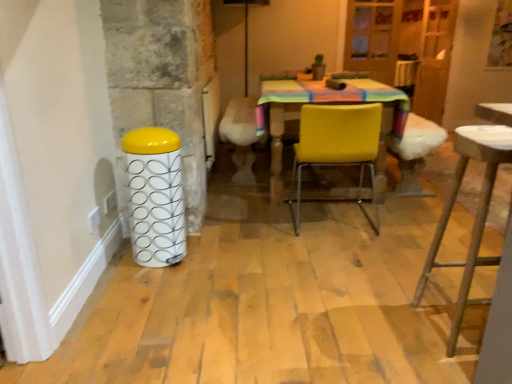
I want to click on yellow matte chair at center, so click(338, 147).

Is yellow matte chair at center far from white glossy bar stool at left?

yellow matte chair at center is actually quite close to white glossy bar stool at left.

Which point is more forward, (322, 163) or (138, 187)?

Positioned in front is point (138, 187).

Is white glossy bar stool at left completely or partially inside yellow matte chair at center?

No.

From a real-world perspective, is yellow matte chair at center physically below white glossy bar stool at left?

No.

Which object is closer to the camera, white glossy bar stool at left or yellow matte chair at center?

white glossy bar stool at left is more forward.

Is white glossy bar stool at left turned away from yellow matte chair at center?

No, white glossy bar stool at left's orientation is not away from yellow matte chair at center.

Can you confirm if white glossy bar stool at left is positioned to the left of yellow matte chair at center?

Indeed, white glossy bar stool at left is positioned on the left side of yellow matte chair at center.

Is metallic stool at right with white glossy bar stool at left?

No, metallic stool at right is not with white glossy bar stool at left.

Between point (475, 145) and point (157, 197), which one is positioned behind?

The point (157, 197) is farther from the camera.

Consider the image. Is the depth of metallic stool at right greater than that of white glossy bar stool at left?

No, it is not.

Considering the sizes of objects metallic stool at right and white glossy bar stool at left in the image provided, who is bigger, metallic stool at right or white glossy bar stool at left?

With larger size is metallic stool at right.

Is yellow matte chair at center surrounded by metallic stool at right?

No, yellow matte chair at center is not inside metallic stool at right.

From a real-world perspective, does metallic stool at right sit lower than yellow matte chair at center?

No, from a real-world perspective, metallic stool at right is not under yellow matte chair at center.

Would you consider metallic stool at right to be distant from yellow matte chair at center?

metallic stool at right is near yellow matte chair at center, not far away.

Visually, is metallic stool at right positioned to the left or to the right of yellow matte chair at center?

metallic stool at right is to the right of yellow matte chair at center.

Is yellow matte chair at center thinner than metallic stool at right?

No, yellow matte chair at center is not thinner than metallic stool at right.

You are a GUI agent. You are given a task and a screenshot of the screen. Output one action in this format:
    pyautogui.click(x=<x>, y=<y>)
    Task: Click on the stool that appears below the yellow matte chair at center (from the image's perspective)
    
    Given the screenshot: What is the action you would take?
    pyautogui.click(x=475, y=216)

In the scene shown: Considering the sizes of objects yellow matte chair at center and metallic stool at right in the image provided, who is smaller, yellow matte chair at center or metallic stool at right?

With smaller size is metallic stool at right.

How different are the orientations of yellow matte chair at center and metallic stool at right in degrees?

There is a 178-degree angle between the facing directions of yellow matte chair at center and metallic stool at right.

Looking at this image, considering the positions of objects white glossy bar stool at left and metallic stool at right in the image provided, who is more to the right, white glossy bar stool at left or metallic stool at right?

metallic stool at right.

Considering the sizes of objects white glossy bar stool at left and metallic stool at right in the image provided, who is thinner, white glossy bar stool at left or metallic stool at right?

Thinner between the two is white glossy bar stool at left.

Is white glossy bar stool at left taller than metallic stool at right?

Incorrect, the height of white glossy bar stool at left is not larger of that of metallic stool at right.

Which of these two, white glossy bar stool at left or metallic stool at right, is smaller?

Smaller between the two is white glossy bar stool at left.

You are a GUI agent. You are given a task and a screenshot of the screen. Output one action in this format:
    pyautogui.click(x=<x>, y=<y>)
    Task: Click on the bar stool below the yellow matte chair at center (from the image's perspective)
    
    Given the screenshot: What is the action you would take?
    pyautogui.click(x=155, y=196)

In order to click on bar stool in front of the yellow matte chair at center in this screenshot , I will do `click(155, 196)`.

Considering their positions, is metallic stool at right positioned closer to yellow matte chair at center than white glossy bar stool at left?

white glossy bar stool at left lies closer to yellow matte chair at center than the other object.

Based on their spatial positions, is yellow matte chair at center or white glossy bar stool at left further from metallic stool at right?

white glossy bar stool at left is further to metallic stool at right.

From the image, which object appears to be nearer to white glossy bar stool at left, metallic stool at right or yellow matte chair at center?

yellow matte chair at center is positioned closer to the anchor white glossy bar stool at left.

Considering their positions, is white glossy bar stool at left positioned closer to metallic stool at right than yellow matte chair at center?

The object closer to metallic stool at right is yellow matte chair at center.

Which object lies further to the anchor point yellow matte chair at center, white glossy bar stool at left or metallic stool at right?

Based on the image, metallic stool at right appears to be further to yellow matte chair at center.

Estimate the real-world distances between objects in this image. Which object is closer to white glossy bar stool at left, yellow matte chair at center or metallic stool at right?

Among the two, yellow matte chair at center is located nearer to white glossy bar stool at left.

Where is `chair between white glossy bar stool at left and metallic stool at right`? The height and width of the screenshot is (384, 512). chair between white glossy bar stool at left and metallic stool at right is located at coordinates (338, 147).